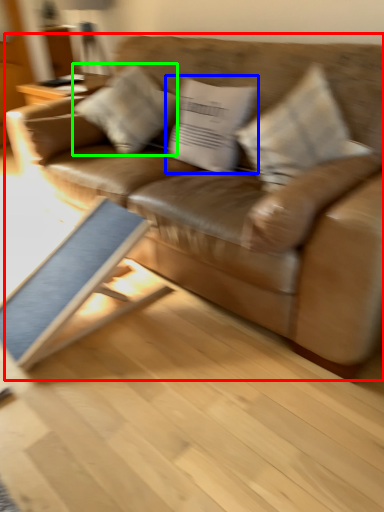
Question: Which object is positioned farthest from studio couch (highlighted by a red box)? Select from pillow (highlighted by a blue box) and pillow (highlighted by a green box).

Choices:
 (A) pillow
 (B) pillow

Answer: (B)